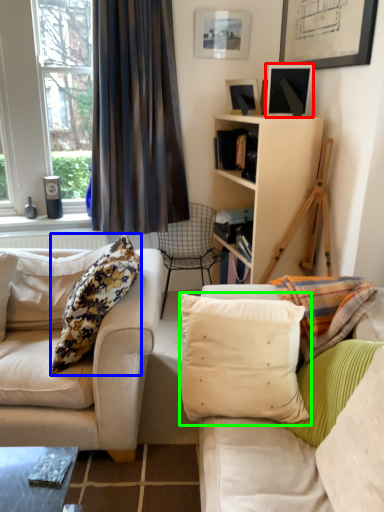
Question: Which object is positioned closest to picture frame (highlighted by a red box)? Select from pillow (highlighted by a blue box) and pillow (highlighted by a green box).

Choices:
 (A) pillow
 (B) pillow

Answer: (A)